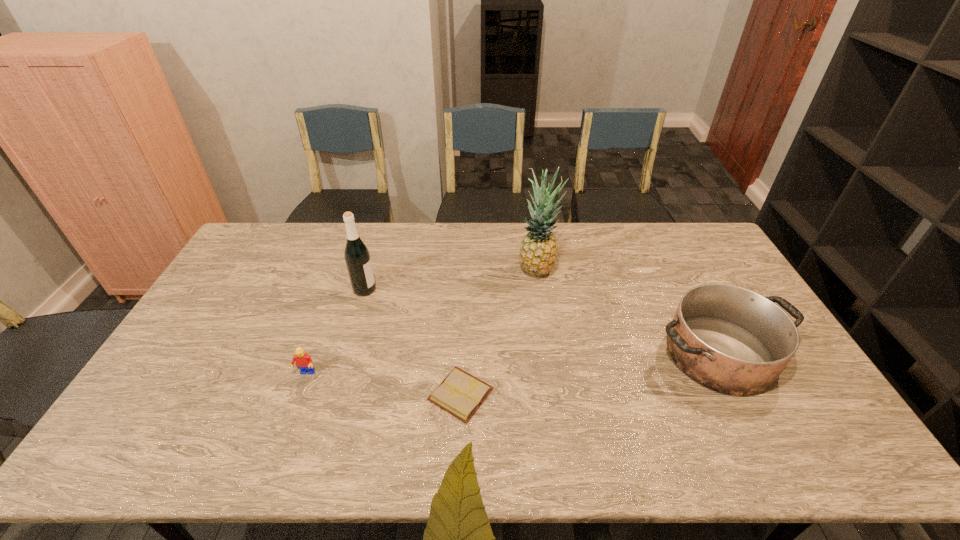
Find the location of `the second object from right to left`. the second object from right to left is located at coordinates (538, 253).

Where is `pineapple`? pineapple is located at coordinates (538, 253).

This screenshot has height=540, width=960. Identify the location of the fourth shortest object. (357, 257).

At what (x,y) coordinates should I click in order to perform the action: click on the fourth object from right to left. Please return your answer as a coordinate pair (x, y). This screenshot has width=960, height=540. Looking at the image, I should click on (357, 257).

Where is `saucepan`? saucepan is located at coordinates (732, 340).

Image resolution: width=960 pixels, height=540 pixels. In order to click on the third tallest object in this screenshot , I will do `click(732, 340)`.

The image size is (960, 540). Identify the location of Lego. (304, 362).

Locate an element on the screen. Image resolution: width=960 pixels, height=540 pixels. the fourth tallest object is located at coordinates (304, 362).

Where is `the third object from left to right`? Image resolution: width=960 pixels, height=540 pixels. the third object from left to right is located at coordinates (460, 394).

The height and width of the screenshot is (540, 960). Identify the location of diary. (460, 394).